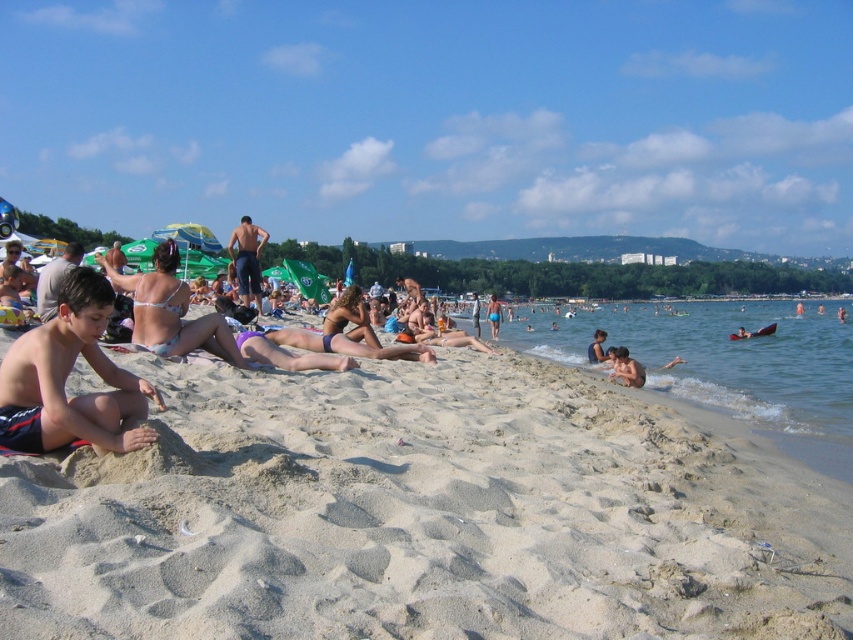
Locate an element on the screen. This screenshot has width=853, height=640. clear blue water at lower right is located at coordinates (718, 355).

The image size is (853, 640). What do you see at coordinates (718, 355) in the screenshot? I see `clear blue water at lower right` at bounding box center [718, 355].

Identify the location of clear blue water at lower right. Image resolution: width=853 pixels, height=640 pixels. (718, 355).

Who is lower down, clear blue water at lower right or dark blue shorts at lower left?

Positioned lower is dark blue shorts at lower left.

Can you confirm if clear blue water at lower right is shorter than dark blue shorts at lower left?

No.

Which is behind, point (802, 369) or point (80, 436)?

Positioned behind is point (802, 369).

The height and width of the screenshot is (640, 853). What are the coordinates of `clear blue water at lower right` in the screenshot? It's located at (718, 355).

Is dark blue shorts at lower left smaller than dark blue shorts at center?

Correct, dark blue shorts at lower left occupies less space than dark blue shorts at center.

Does dark blue shorts at lower left have a lesser width compared to dark blue shorts at center?

Yes.

Is point (27, 435) less distant than point (256, 304)?

That is True.

What are the coordinates of `dark blue shorts at lower left` in the screenshot? It's located at (67, 378).